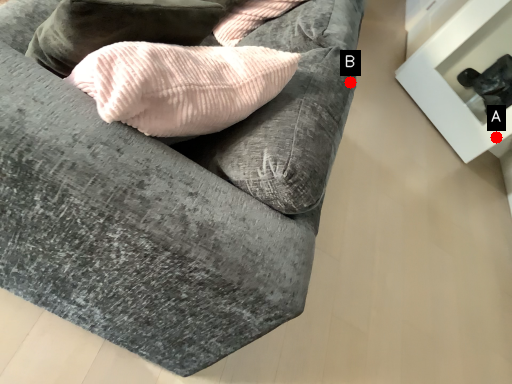
Question: Two points are circled on the image, labeled by A and B beside each circle. Among these points, which one is nearest to the camera?

Choices:
 (A) A is closer
 (B) B is closer

Answer: (B)